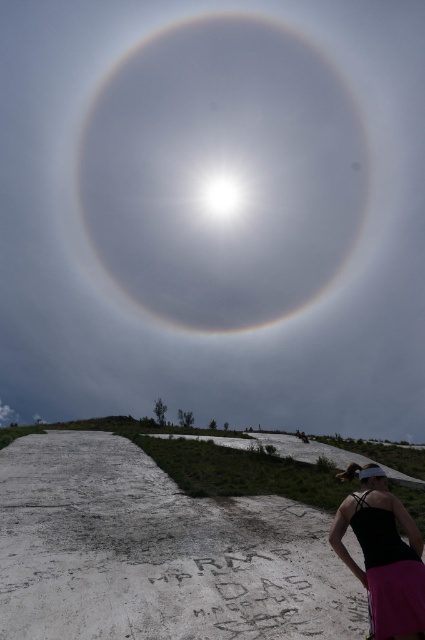
Is white translucent halo at upper center above black fabric tank top at lower right?

Yes, white translucent halo at upper center is above black fabric tank top at lower right.

Is point (320, 166) positioned before point (376, 570)?

No, (320, 166) is further to viewer.

I want to click on white translucent halo at upper center, so click(223, 173).